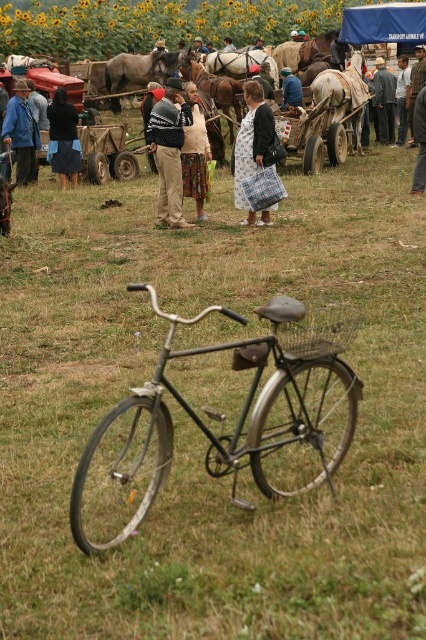
You are a photographer at the fair and want to capture both the plaid fabric bag at center and the brown glossy horse at center in the same frame. Which object should you adjust your camera to focus on first if you want to include both in your shot?

The plaid fabric bag at center is positioned on the right side of brown glossy horse at center, so you should focus on the brown glossy horse at center first to ensure both objects are included in the frame.